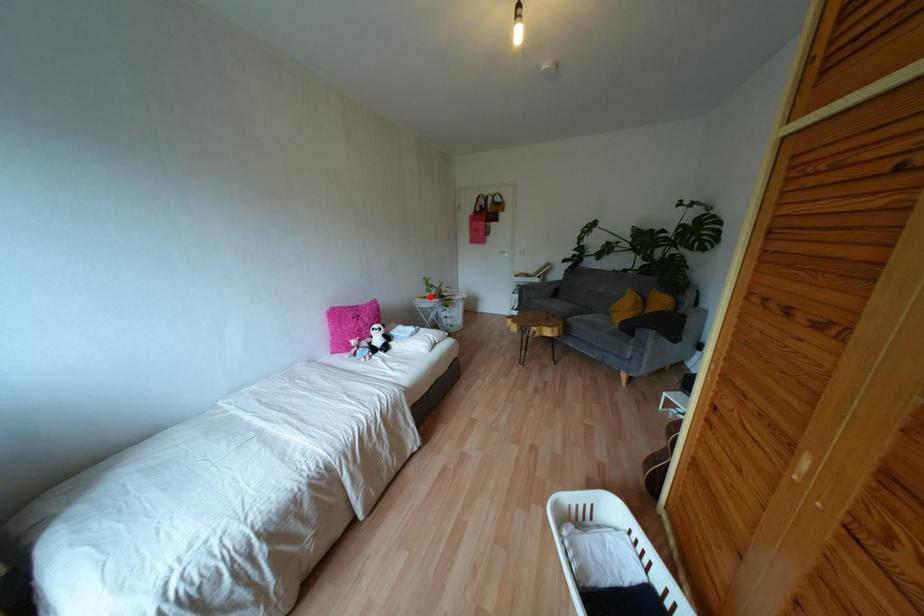
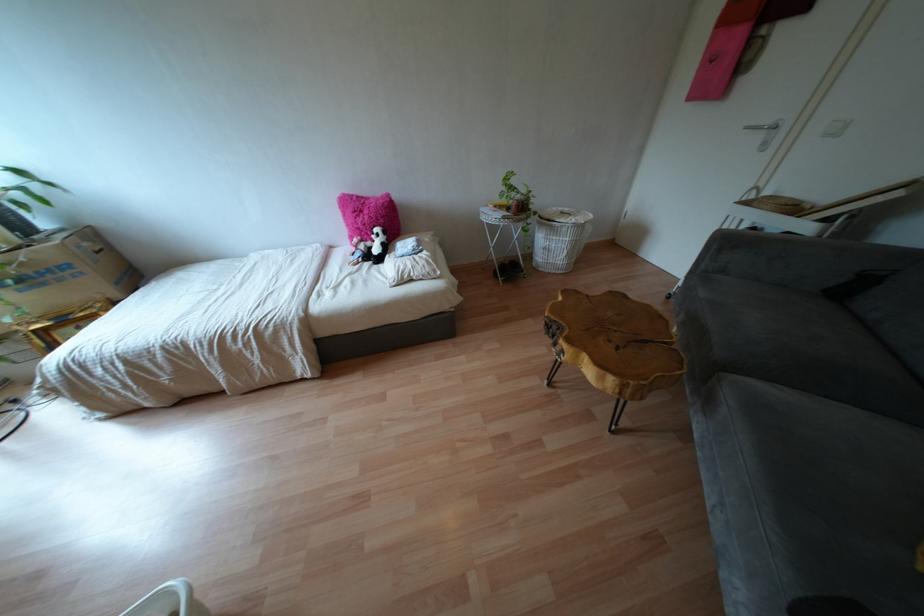
Question: I am providing you with two images of the same scene from different viewpoints. Given a red point in image1, look at the same physical point in image2. Is it:

Choices:
 (A) Closer to the viewpoint
 (B) Farther from the viewpoint

Answer: (A)